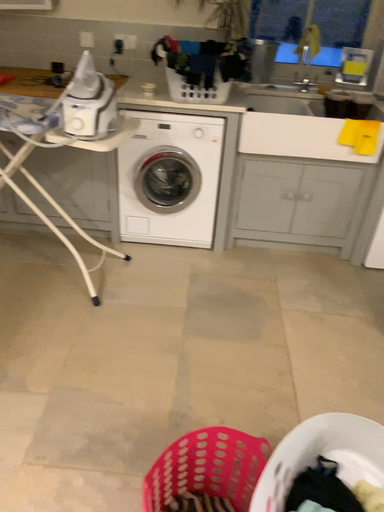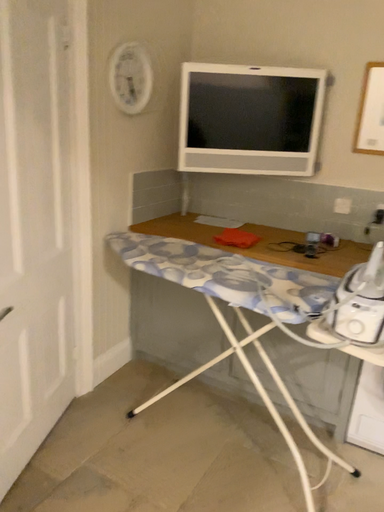
Question: How did the camera likely rotate when shooting the video?

Choices:
 (A) rotated upward
 (B) rotated downward

Answer: (A)